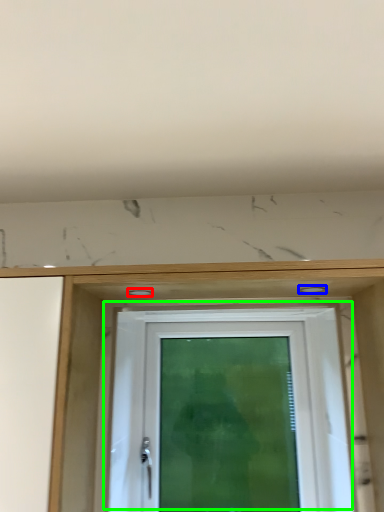
Question: Which is farther away from hole (highlighted by a red box)? hole (highlighted by a blue box) or door (highlighted by a green box)?

Choices:
 (A) hole
 (B) door

Answer: (B)